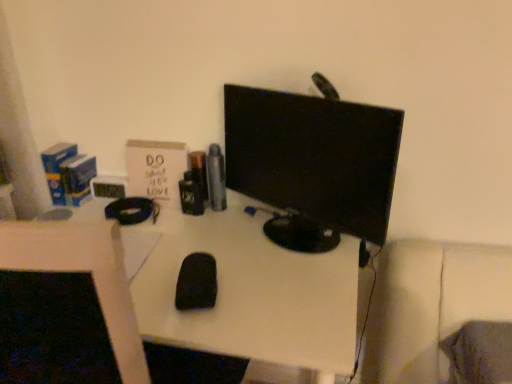
In order to click on free location to the right of black matte mouse at center in this screenshot , I will do `click(273, 288)`.